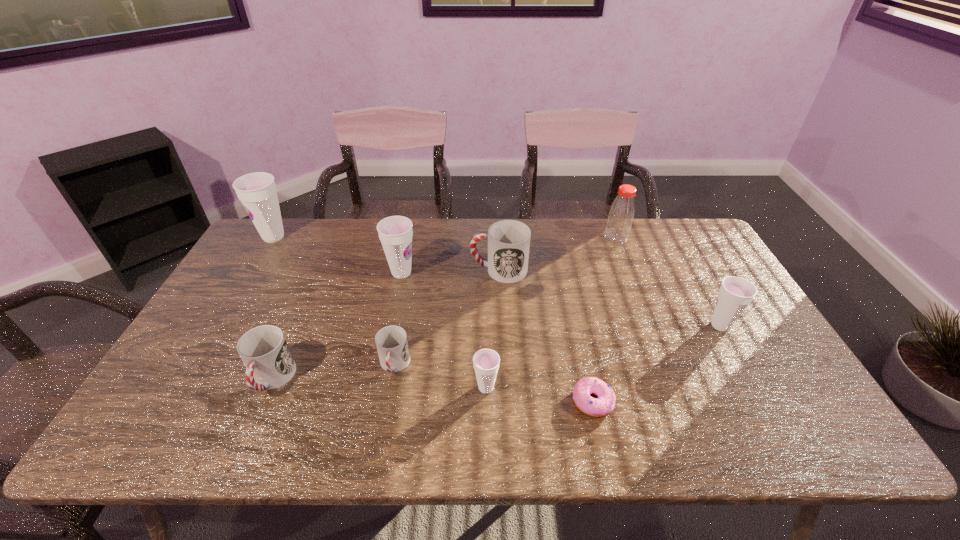
The width and height of the screenshot is (960, 540). I want to click on the leftmost red cup, so click(x=264, y=350).

Find the location of a particular element. Image resolution: width=960 pixels, height=540 pixels. the eighth object from right to left is located at coordinates (264, 350).

Locate an element on the screen. This screenshot has width=960, height=540. the nearest purple cup is located at coordinates (486, 362).

In order to click on the smallest purple cup in this screenshot , I will do `click(486, 362)`.

The image size is (960, 540). I want to click on the shortest cup, so click(x=391, y=341).

Locate an element on the screen. The width and height of the screenshot is (960, 540). the smallest red cup is located at coordinates (391, 341).

Find the location of a particular element. the shortest object is located at coordinates (604, 404).

Identify the location of pink doughnut. The height and width of the screenshot is (540, 960). (604, 404).

Locate an element on the screen. This screenshot has width=960, height=540. vacant position located 0.240m on the right of the leftmost purple cup is located at coordinates (361, 237).

The height and width of the screenshot is (540, 960). In order to click on free space located 0.120m on the left of the second object from right to left in this screenshot , I will do `click(569, 238)`.